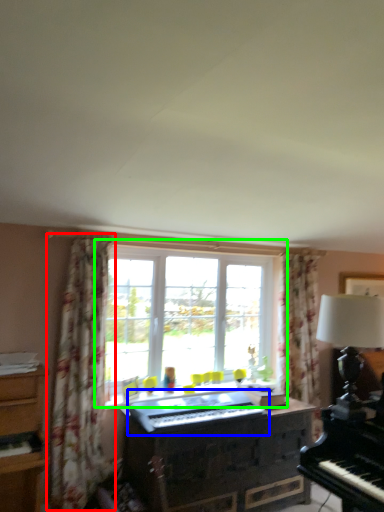
Question: Which object is positioned closest to curtain (highlighted by a red box)? Select from musical keyboard (highlighted by a blue box) and window (highlighted by a green box).

Choices:
 (A) musical keyboard
 (B) window

Answer: (A)